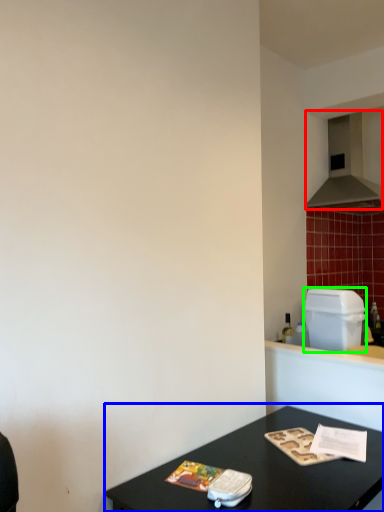
Question: Which is nearer to the exhaust hood (highlighted by a red box)? table (highlighted by a blue box) or appliance (highlighted by a green box).

Choices:
 (A) table
 (B) appliance

Answer: (B)